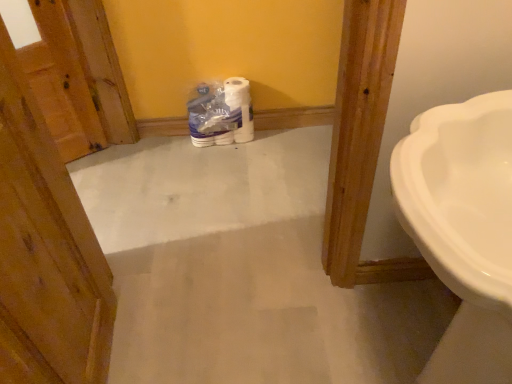
Locate an element on the screen. vacant space positioned to the left of white glossy toilet paper at center is located at coordinates point(174,151).